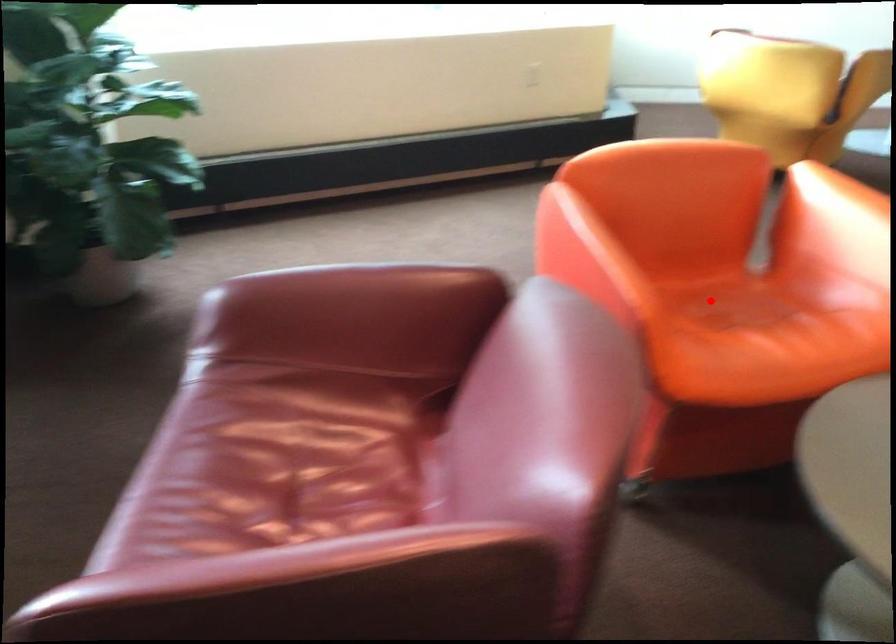
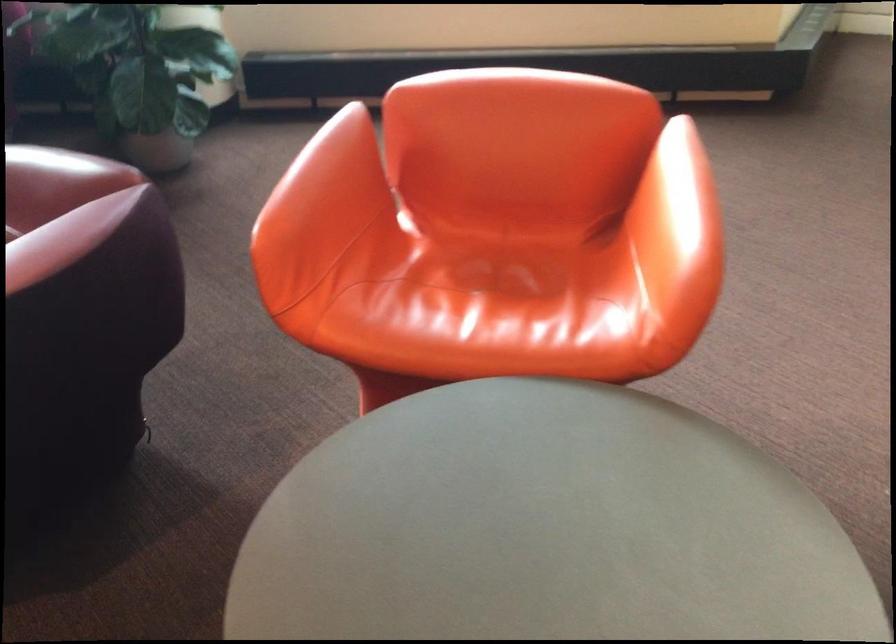
Find the pixel in the second image that matches the highlighted location in the first image.

(487, 261)